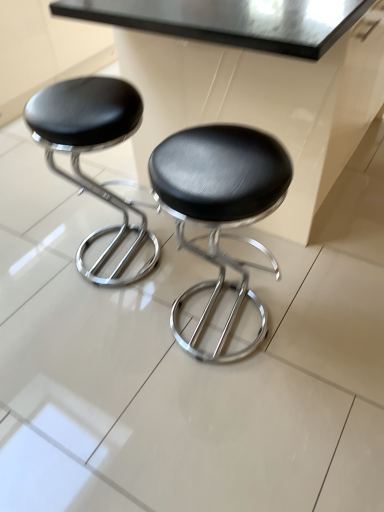
Question: Could you tell me if metallic black table at upper center is turned towards black leather stool at left, marked as the first stool in a left-to-right arrangement?

Choices:
 (A) no
 (B) yes

Answer: (B)

Question: Is black leather stool at left, marked as the first stool in a left-to-right arrangement, at the back of metallic black table at upper center?

Choices:
 (A) no
 (B) yes

Answer: (A)

Question: Is metallic black table at upper center bigger than black leather stool at left, marked as the first stool in a left-to-right arrangement?

Choices:
 (A) no
 (B) yes

Answer: (B)

Question: From the image's perspective, would you say metallic black table at upper center is shown under black leather stool at left, marked as the first stool in a left-to-right arrangement?

Choices:
 (A) no
 (B) yes

Answer: (A)

Question: Is metallic black table at upper center smaller than black leather stool at left, marked as the first stool in a left-to-right arrangement?

Choices:
 (A) no
 (B) yes

Answer: (A)

Question: In the image, is metallic black table at upper center positioned in front of or behind black leather stool at center, the second stool when ordered from left to right?

Choices:
 (A) behind
 (B) front

Answer: (A)

Question: From the image's perspective, is metallic black table at upper center positioned above or below black leather stool at center, arranged as the 1th stool when viewed from the right?

Choices:
 (A) above
 (B) below

Answer: (A)

Question: Looking at their shapes, would you say metallic black table at upper center is wider or thinner than black leather stool at center, the second stool when ordered from left to right?

Choices:
 (A) thin
 (B) wide

Answer: (B)

Question: Does point (345, 52) appear closer or farther from the camera than point (274, 170)?

Choices:
 (A) farther
 (B) closer

Answer: (A)

Question: Does point (352, 115) appear closer or farther from the camera than point (134, 103)?

Choices:
 (A) closer
 (B) farther

Answer: (B)

Question: Based on their sizes in the image, would you say metallic black table at upper center is bigger or smaller than black leather stool at left, marked as the first stool in a left-to-right arrangement?

Choices:
 (A) big
 (B) small

Answer: (A)

Question: Is metallic black table at upper center situated inside black leather stool at left, marked as the first stool in a left-to-right arrangement, or outside?

Choices:
 (A) inside
 (B) outside

Answer: (B)

Question: From the image's perspective, is metallic black table at upper center above or below black leather stool at left, which appears as the second stool when viewed from the right?

Choices:
 (A) above
 (B) below

Answer: (A)

Question: From the image's perspective, is black leather stool at center, arranged as the 1th stool when viewed from the right, located above or below metallic black table at upper center?

Choices:
 (A) above
 (B) below

Answer: (B)

Question: Considering the positions of black leather stool at center, the second stool when ordered from left to right, and metallic black table at upper center in the image, is black leather stool at center, the second stool when ordered from left to right, bigger or smaller than metallic black table at upper center?

Choices:
 (A) small
 (B) big

Answer: (A)